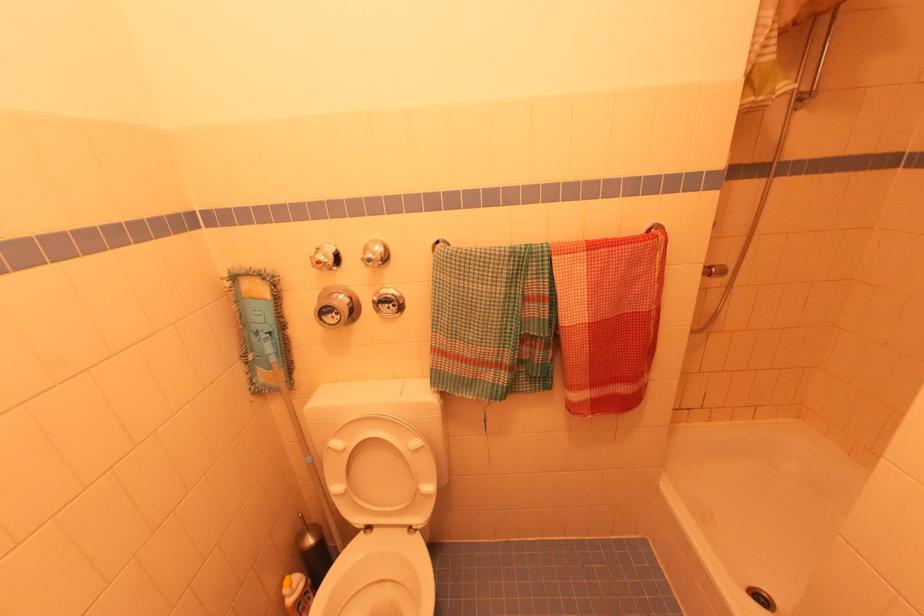
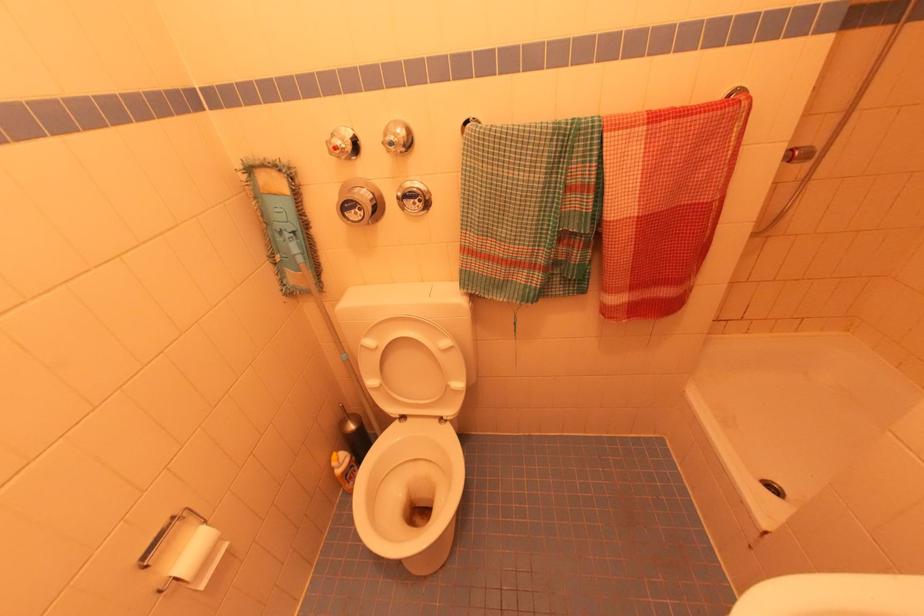
Question: The first image is from the beginning of the video and the second image is from the end. How did the camera likely rotate when shooting the video?

Choices:
 (A) Left
 (B) Right
 (C) Up
 (D) Down

Answer: (D)